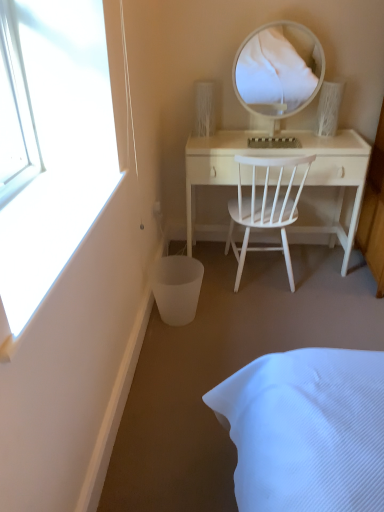
Question: Is white wood desk at center wider or thinner than white wood chair at center?

Choices:
 (A) wide
 (B) thin

Answer: (B)

Question: Is point (340, 237) positioned closer to the camera than point (296, 210)?

Choices:
 (A) closer
 (B) farther

Answer: (A)

Question: Which object is positioned farthest from the white glossy mirror at upper center?

Choices:
 (A) white wood chair at center
 (B) white wood desk at center
 (C) white matte trash bin/can at lower left

Answer: (C)

Question: Estimate the real-world distances between objects in this image. Which object is farther from the white matte trash bin/can at lower left?

Choices:
 (A) white wood chair at center
 (B) white wood desk at center
 (C) white glossy mirror at upper center

Answer: (C)